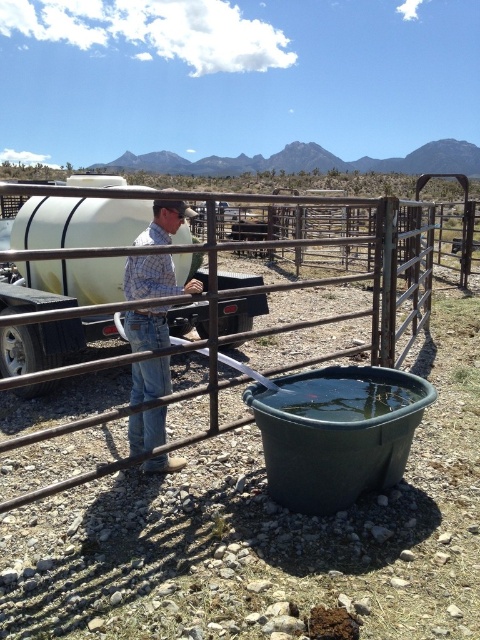
You are a delivery driver who needs to park your truck next to the white matte trailer truck at center. There is a rustic metal fence at center in the way. Can you drive around the fence to the left side of the trailer truck?

The rustic metal fence at center is on the right side of the white matte trailer truck at center, so you can drive around to the left side of the trailer truck to park your truck there.

You are a painter who needs to paint both the rustic metal fence at center and the plaid shirt at center. Which object requires more paint because it has a larger surface area?

Answer: The rustic metal fence at center requires more paint because it is bigger than the plaid shirt at center.